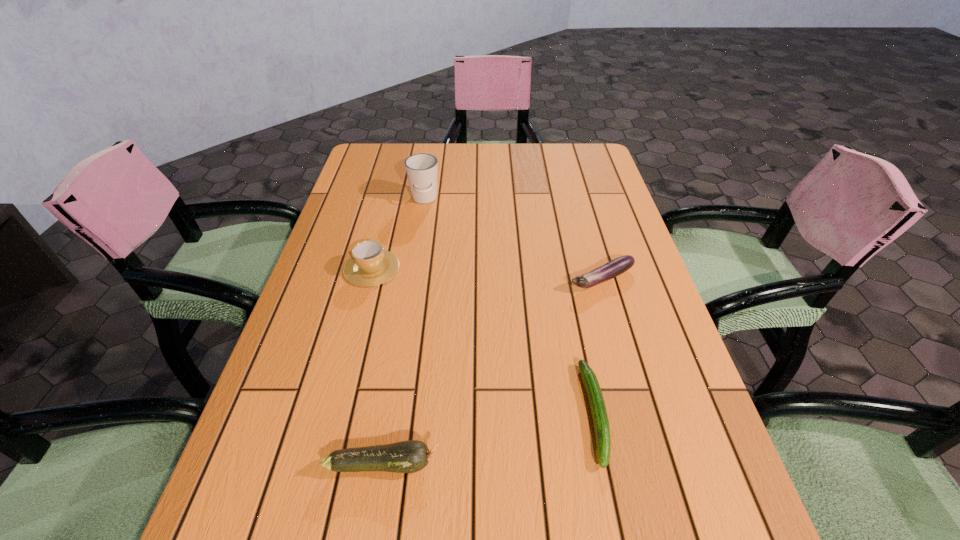
Where is `vacant space at the right edge of the desktop`? The image size is (960, 540). vacant space at the right edge of the desktop is located at coordinates (628, 313).

In order to click on vacant space at the far right corner of the desktop in this screenshot , I will do `click(563, 150)`.

Locate an element on the screen. free space between the taller zucchini and the fourth tallest object is located at coordinates (492, 372).

The width and height of the screenshot is (960, 540). What are the coordinates of `empty space between the taller cup and the shorter zucchini` in the screenshot? It's located at (510, 306).

Locate an element on the screen. free spot between the taller cup and the left zucchini is located at coordinates (404, 331).

This screenshot has width=960, height=540. I want to click on empty space between the taller cup and the taller zucchini, so click(404, 331).

Identify the location of vacant space that's between the nearer cup and the tallest object. (398, 234).

This screenshot has width=960, height=540. In order to click on vacant area that lies between the left zucchini and the farthest object in this screenshot , I will do `click(404, 331)`.

Where is `vacant area that lies between the taller zucchini and the right zucchini`? The height and width of the screenshot is (540, 960). vacant area that lies between the taller zucchini and the right zucchini is located at coordinates (490, 438).

Image resolution: width=960 pixels, height=540 pixels. I want to click on vacant space that is in between the shortest object and the eggplant, so click(x=598, y=346).